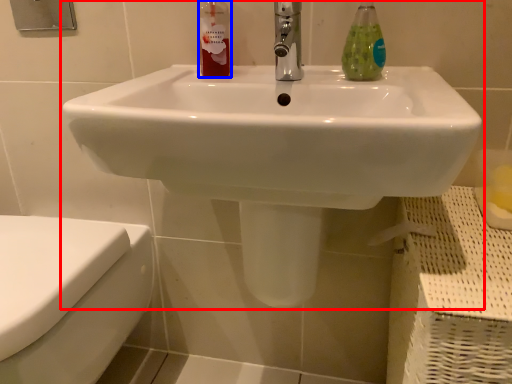
Question: Among these objects, which one is farthest to the camera, sink (highlighted by a red box) or cleaning product (highlighted by a blue box)?

Choices:
 (A) sink
 (B) cleaning product

Answer: (B)